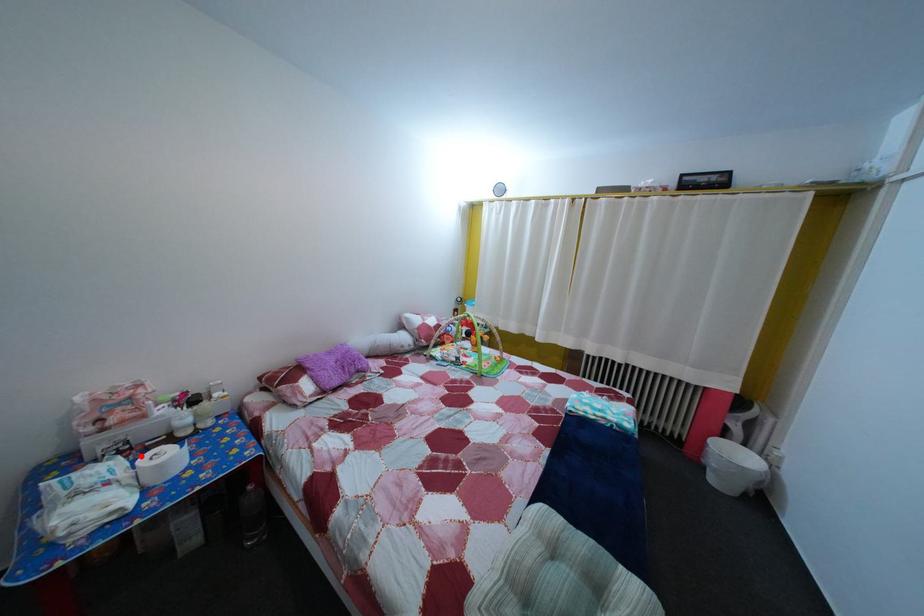
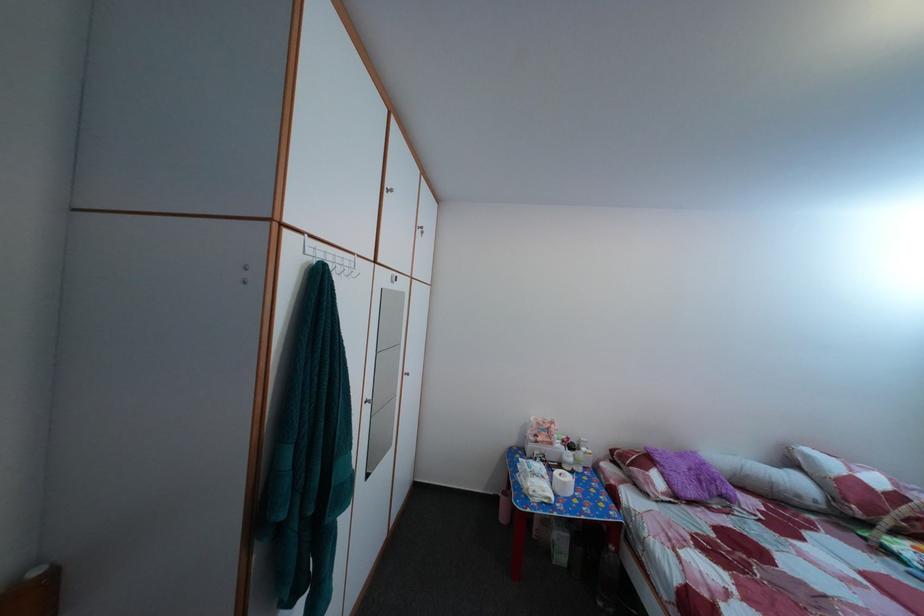
Question: I am providing you with two images of the same scene from different viewpoints. Given a red point in image1, look at the same physical point in image2. Is it:

Choices:
 (A) Closer to the viewpoint
 (B) Farther from the viewpoint

Answer: (B)